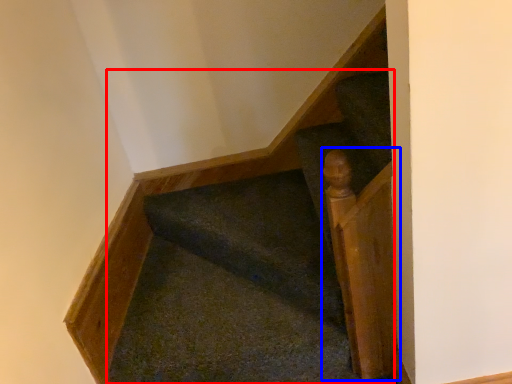
Question: Which of the following is the closest to the observer, stairs (highlighted by a red box) or rail (highlighted by a blue box)?

Choices:
 (A) stairs
 (B) rail

Answer: (B)